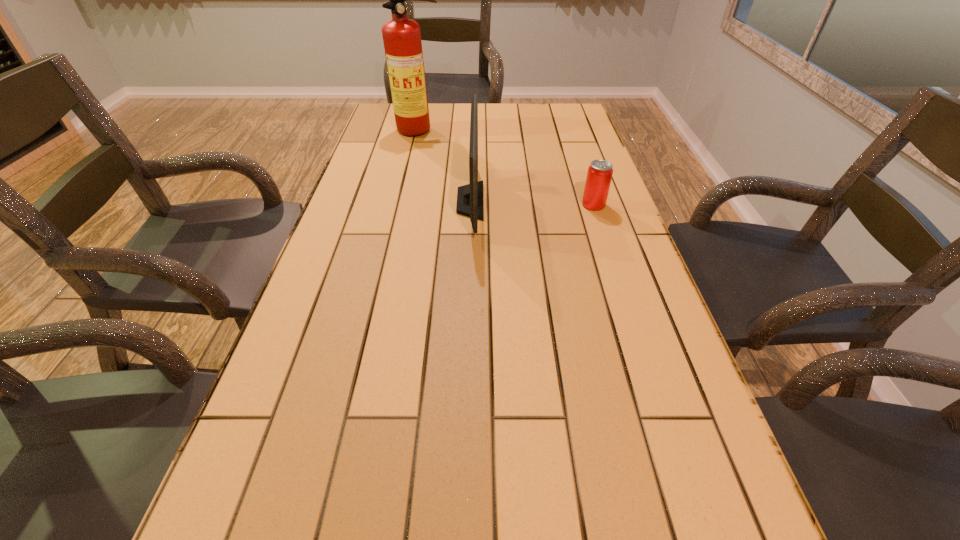
Where is `vacant region between the can and the second object from left to right`? vacant region between the can and the second object from left to right is located at coordinates (532, 203).

This screenshot has height=540, width=960. Find the location of `vacant area between the tallest object and the second shortest object`. vacant area between the tallest object and the second shortest object is located at coordinates (444, 166).

Identify the location of object that is the closest to the second object from right to left. (402, 42).

Identify which object is the second closest to the second object from left to right. Please provide its 2D coordinates. Your answer should be formatted as a tuple, i.e. [(x, y)], where the tuple contains the x and y coordinates of a point satisfying the conditions above.

[(599, 175)]

Locate an element on the screen. The image size is (960, 540). vacant area that satisfies the following two spatial constraints: 1. on the front-facing side of the farthest object; 2. on the left side of the can is located at coordinates (402, 205).

Where is `vacant position in the image that satisfies the following two spatial constraints: 1. on the front-facing side of the shortest object; 2. on the left side of the tallest object`? Image resolution: width=960 pixels, height=540 pixels. vacant position in the image that satisfies the following two spatial constraints: 1. on the front-facing side of the shortest object; 2. on the left side of the tallest object is located at coordinates (402, 205).